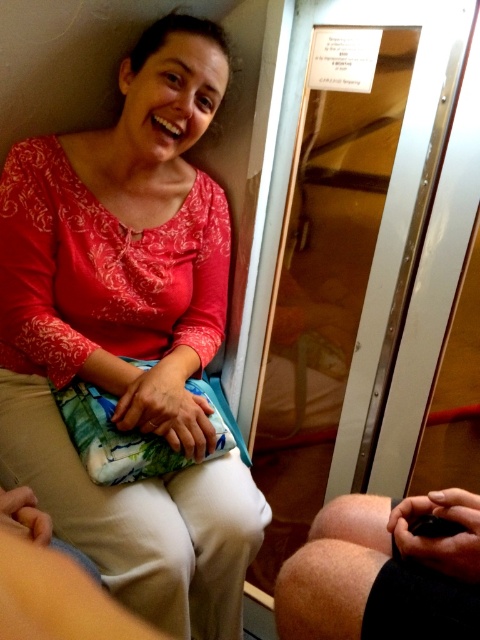
You are a photographer trying to capture a closeup of the matte floral skirt at center and the hairy skin at lower right. Given their sizes, which one would you need to move closer to the camera to ensure both appear equally sized in the photo?

The matte floral skirt at center is larger than the hairy skin at lower right, so you would need to move the hairy skin at lower right closer to the camera to make them appear the same size.

You are a photographer adjusting your camera settings to capture the scene. You notice the matte floral skirt at center and the hairy skin at lower right. Which object is covering the other?

The matte floral skirt at center is positioned over the hairy skin at lower right, so the skirt is covering the skin.

You are a photographer trying to capture a candid shot of the woman in the scene. You notice the matte floral skirt at center and the hairy skin at lower right. Which object is located more to the left side of the image?

The matte floral skirt at center is positioned on the left side of the hairy skin at lower right, so it is more to the left.